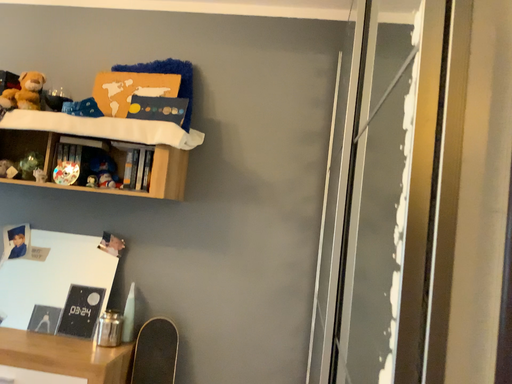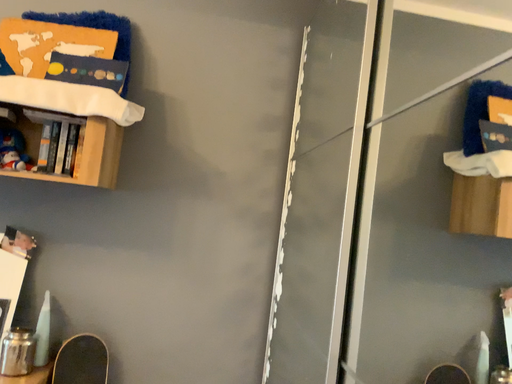
Question: How did the camera likely rotate when shooting the video?

Choices:
 (A) rotated right
 (B) rotated left

Answer: (A)